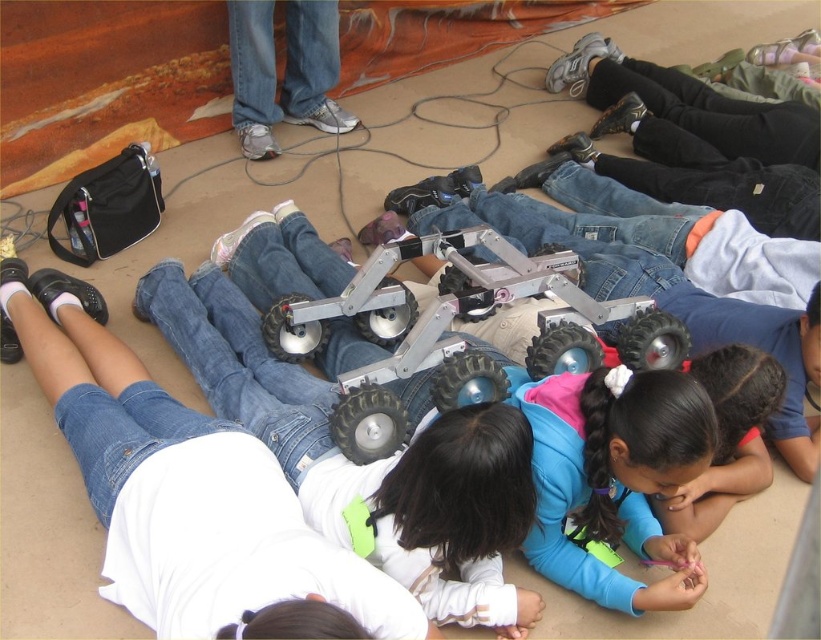
You are a photographer trying to capture a closeup of the metallic frame of the robot while ensuring the children remain in the shot. Given the point at coordinates point (615, 477) is on blue matte jacket at center, where should you position your camera to include both the robot and the child in the blue matte jacket?

To include both the metallic frame of the robot and the child in the blue matte jacket at the point (615, 477), position the camera so it faces towards the center area where the robot and the child in the blue matte jacket are both visible. Since the point is on the jacket at center, aligning the camera to focus on that central region will capture both elements within the frame.